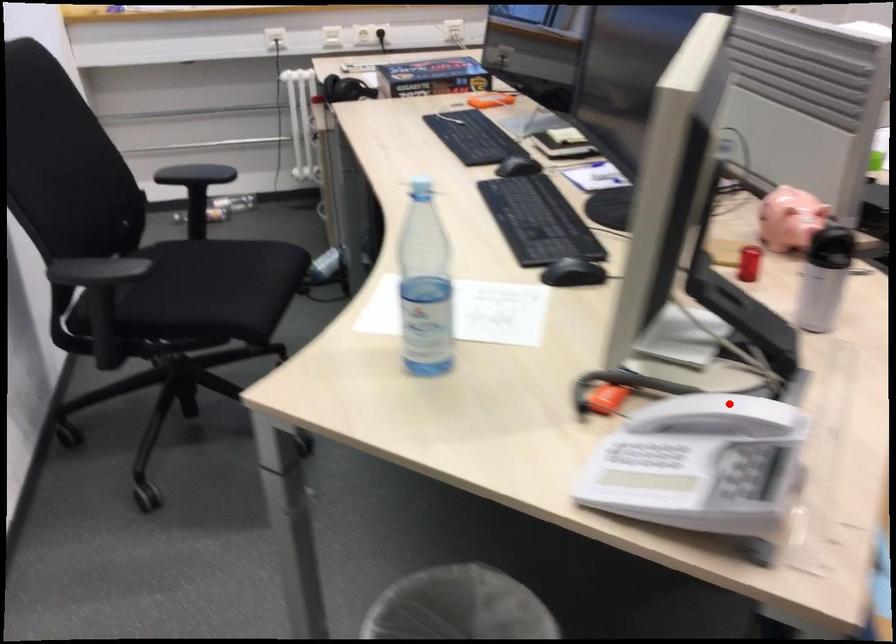
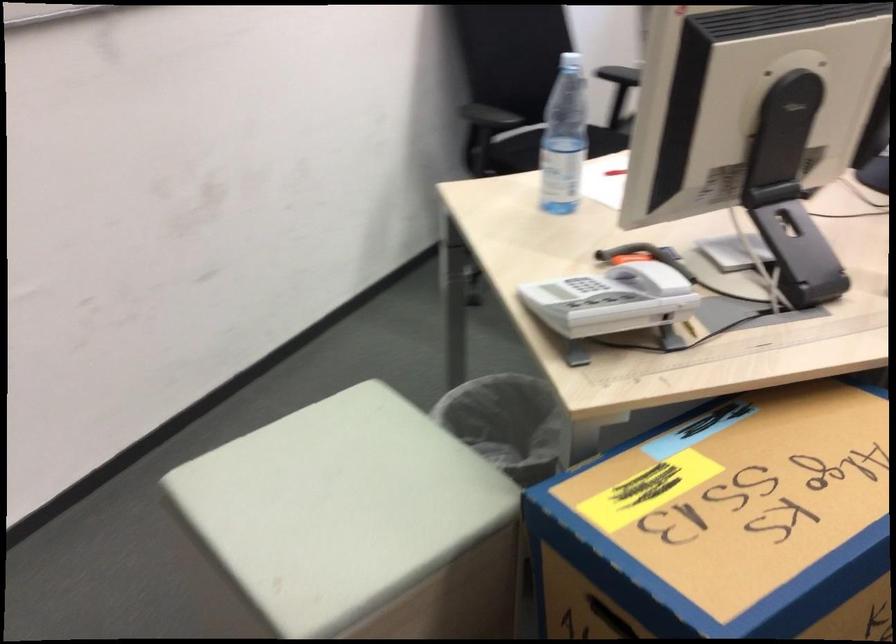
Find the pixel in the second image that matches the highlighted location in the first image.

(648, 268)